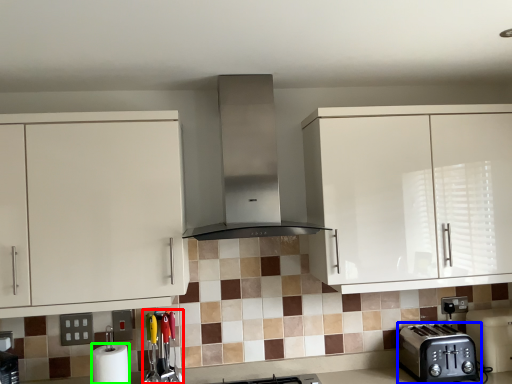
Question: Based on their relative distances, which object is nearer to appliance (highlighted by a red box)? Choose from toaster (highlighted by a blue box) and paper towel (highlighted by a green box).

Choices:
 (A) toaster
 (B) paper towel

Answer: (B)